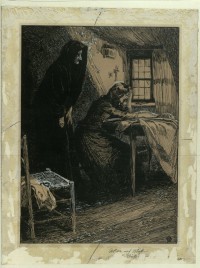
I want to click on fabric, so pos(158,140).